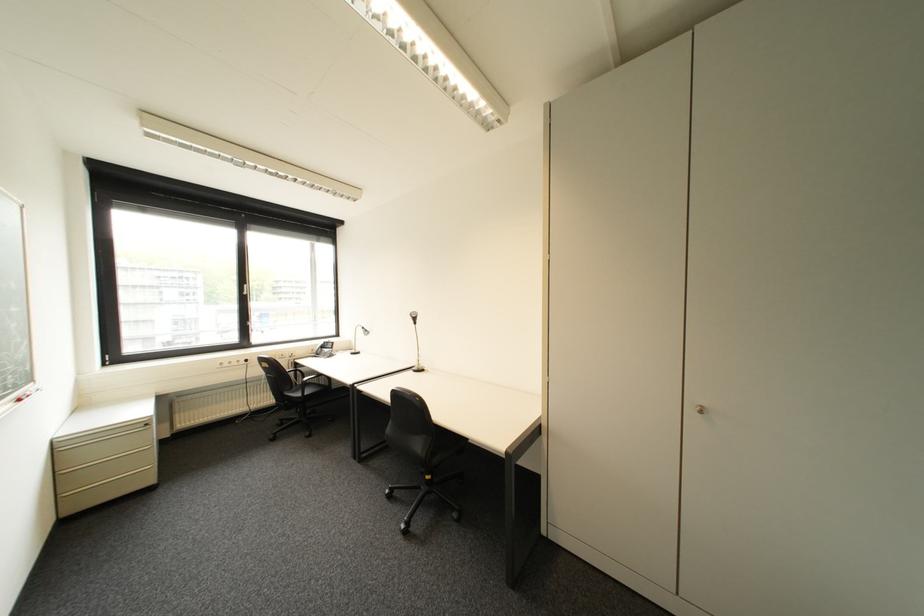
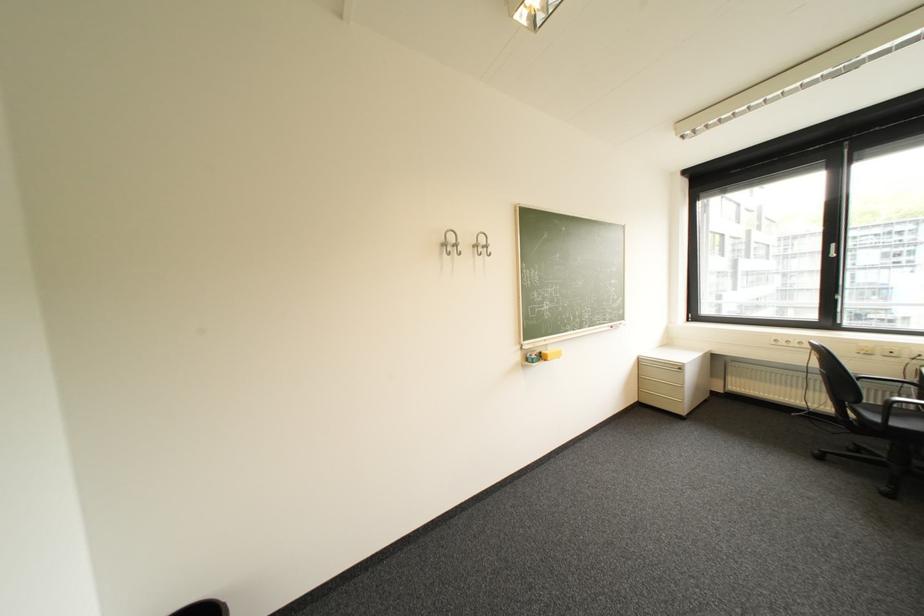
Question: The camera is either moving clockwise (left) or counter-clockwise (right) around the object. The first image is from the beginning of the video and the second image is from the end. Is the camera moving left or right when shooting the video?

Choices:
 (A) Left
 (B) Right

Answer: (B)